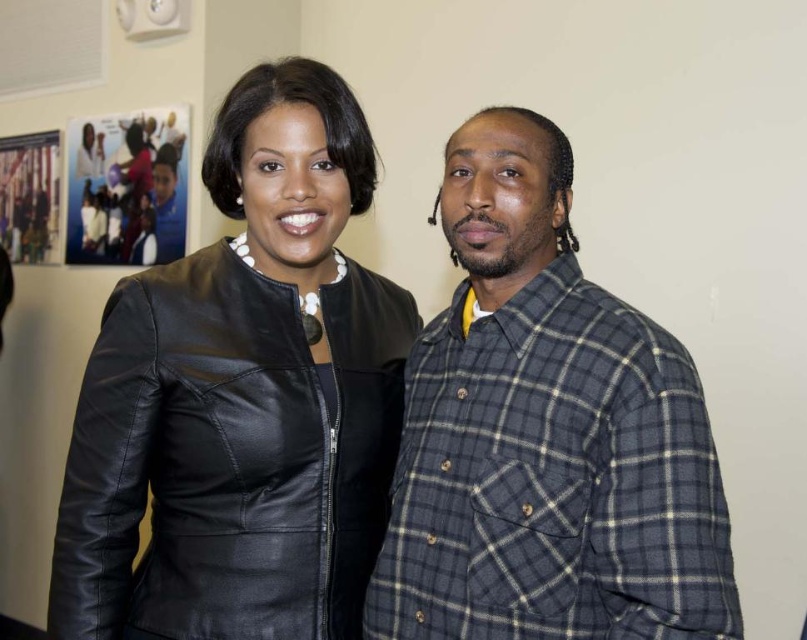
Question: Where is black leather jacket at center located in relation to plaid flannel shirt at right in the image?

Choices:
 (A) above
 (B) below

Answer: (A)

Question: Which point is farther from the camera taking this photo?

Choices:
 (A) (525, 556)
 (B) (314, 436)

Answer: (B)

Question: Among these points, which one is nearest to the camera?

Choices:
 (A) (199, 602)
 (B) (633, 365)

Answer: (B)

Question: Is black leather jacket at center positioned at the back of plaid flannel shirt at right?

Choices:
 (A) yes
 (B) no

Answer: (A)

Question: Which point is farther from the camera taking this photo?

Choices:
 (A) (726, 628)
 (B) (312, 500)

Answer: (B)

Question: Is the position of black leather jacket at center less distant than that of plaid flannel shirt at right?

Choices:
 (A) no
 (B) yes

Answer: (A)